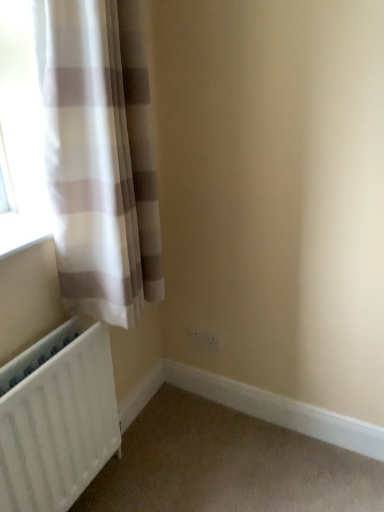
Question: Is white matte radiator at lower left outside of white plastic electric outlet at lower center?

Choices:
 (A) yes
 (B) no

Answer: (A)

Question: Is the depth of white matte radiator at lower left less than that of white plastic electric outlet at lower center?

Choices:
 (A) yes
 (B) no

Answer: (A)

Question: From a real-world perspective, is white matte radiator at lower left positioned over white plastic electric outlet at lower center based on gravity?

Choices:
 (A) yes
 (B) no

Answer: (A)

Question: Can you confirm if white matte radiator at lower left is smaller than white plastic electric outlet at lower center?

Choices:
 (A) yes
 (B) no

Answer: (B)

Question: Considering the relative sizes of white matte radiator at lower left and white plastic electric outlet at lower center in the image provided, is white matte radiator at lower left wider than white plastic electric outlet at lower center?

Choices:
 (A) yes
 (B) no

Answer: (A)

Question: From a real-world perspective, is white matte radiator at lower left above or below white sheer curtain at left?

Choices:
 (A) below
 (B) above

Answer: (A)

Question: Is point click(x=41, y=467) positioned closer to the camera than point click(x=135, y=278)?

Choices:
 (A) farther
 (B) closer

Answer: (B)

Question: Based on their positions, is white matte radiator at lower left located to the left or right of white sheer curtain at left?

Choices:
 (A) left
 (B) right

Answer: (A)

Question: From the image's perspective, is white matte radiator at lower left positioned above or below white sheer curtain at left?

Choices:
 (A) below
 (B) above

Answer: (A)

Question: Looking at their shapes, would you say white sheer curtain at left is wider or thinner than white matte radiator at lower left?

Choices:
 (A) thin
 (B) wide

Answer: (B)

Question: In the image, is white sheer curtain at left on the left side or the right side of white matte radiator at lower left?

Choices:
 (A) right
 (B) left

Answer: (A)

Question: Is white sheer curtain at left inside or outside of white matte radiator at lower left?

Choices:
 (A) inside
 (B) outside

Answer: (B)

Question: Considering the positions of white sheer curtain at left and white matte radiator at lower left in the image, is white sheer curtain at left bigger or smaller than white matte radiator at lower left?

Choices:
 (A) big
 (B) small

Answer: (A)

Question: Is white sheer curtain at left in front of or behind white plastic electric outlet at lower center in the image?

Choices:
 (A) front
 (B) behind

Answer: (A)

Question: Is white sheer curtain at left wider or thinner than white plastic electric outlet at lower center?

Choices:
 (A) wide
 (B) thin

Answer: (A)